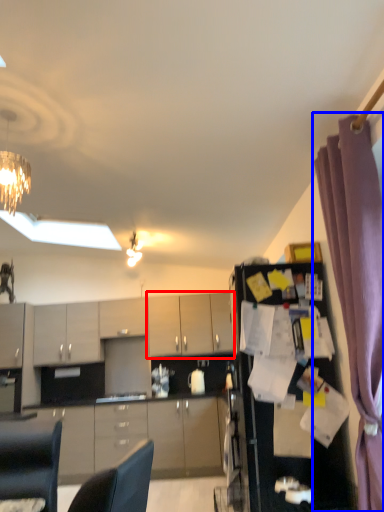
Question: Which object is closer to the camera taking this photo, cabinetry (highlighted by a red box) or curtain (highlighted by a blue box)?

Choices:
 (A) cabinetry
 (B) curtain

Answer: (B)